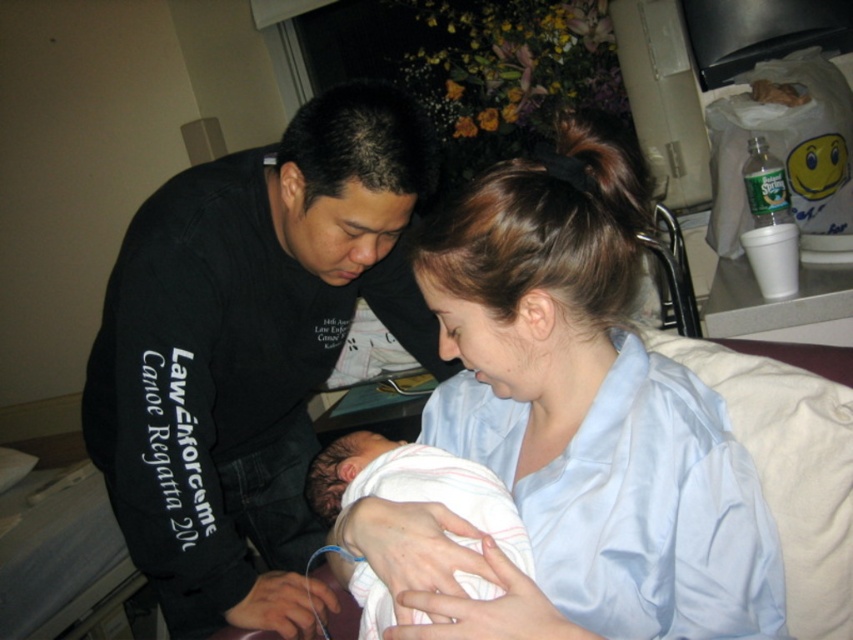
Does point (712, 397) come closer to viewer compared to point (242, 204)?

Yes, it is.

Is point (498, 280) positioned in front of point (122, 301)?

Yes, point (498, 280) is in front of point (122, 301).

Where is `light blue satin shirt at center`? The height and width of the screenshot is (640, 853). light blue satin shirt at center is located at coordinates (585, 416).

Who is higher up, light blue satin shirt at center or white soft cloth at center?

light blue satin shirt at center is above.

Is light blue satin shirt at center shorter than white soft cloth at center?

No, light blue satin shirt at center is not shorter than white soft cloth at center.

Is point (556, 602) behind point (352, 470)?

That is False.

Find the location of a particular element. The height and width of the screenshot is (640, 853). light blue satin shirt at center is located at coordinates (585, 416).

The width and height of the screenshot is (853, 640). Describe the element at coordinates (248, 349) in the screenshot. I see `black matte shirt at center` at that location.

Based on the photo, does black matte shirt at center lie in front of white soft cloth at center?

No.

The width and height of the screenshot is (853, 640). Find the location of `black matte shirt at center`. black matte shirt at center is located at coordinates (248, 349).

Image resolution: width=853 pixels, height=640 pixels. In order to click on black matte shirt at center in this screenshot , I will do `click(248, 349)`.